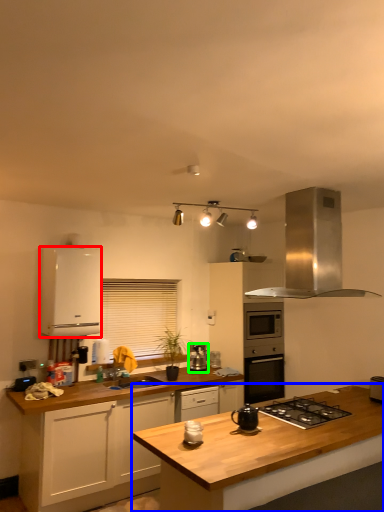
Question: Which is nearer to the cabinetry (highlighted by a red box)? countertop (highlighted by a blue box) or kitchen appliance (highlighted by a green box).

Choices:
 (A) countertop
 (B) kitchen appliance

Answer: (B)